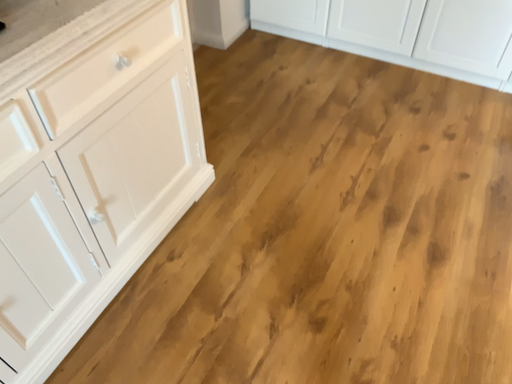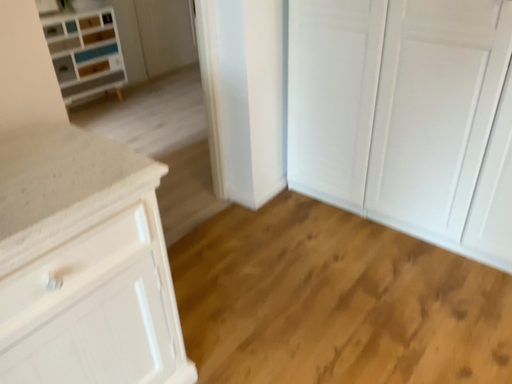
Question: How did the camera likely rotate when shooting the video?

Choices:
 (A) rotated upward
 (B) rotated downward

Answer: (A)